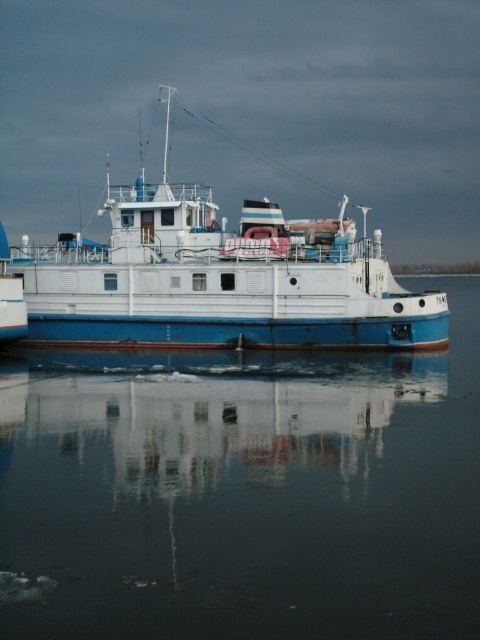
Question: Where is smooth water at center located in relation to white matte boat at center in the image?

Choices:
 (A) below
 (B) above

Answer: (A)

Question: Which point is farther to the camera?

Choices:
 (A) smooth water at center
 (B) white matte boat at center

Answer: (B)

Question: Does smooth water at center have a larger size compared to white matte boat at center?

Choices:
 (A) no
 (B) yes

Answer: (A)

Question: Which point appears closest to the camera in this image?

Choices:
 (A) (295, 273)
 (B) (120, 436)

Answer: (B)

Question: In this image, where is smooth water at center located relative to white matte boat at center?

Choices:
 (A) below
 (B) above

Answer: (A)

Question: Which point is closer to the camera?

Choices:
 (A) (268, 246)
 (B) (348, 424)

Answer: (B)